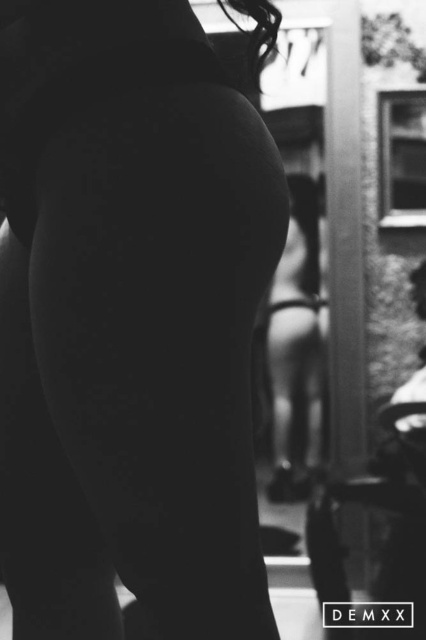
You are a photographer who wants to focus on the smooth skin at center in the image. The camera has a focus grid that shows coordinates from 0 to 1 on both axes. What are the coordinates where you should aim the focus point?

The smooth skin at center is located at point (129, 321), so you should aim the focus point at those coordinates to focus on it.

You are a photographer analyzing the composition of this black and white photo. You notice two figures with smooth skin. The first is labeled as smooth skin at center, and the second is smooth skin girl at center. Based on their positions, which figure is positioned higher in the frame?

The smooth skin at center is positioned higher in the frame than the smooth skin girl at center because the description states that smooth skin at center is above smooth skin girl at center.